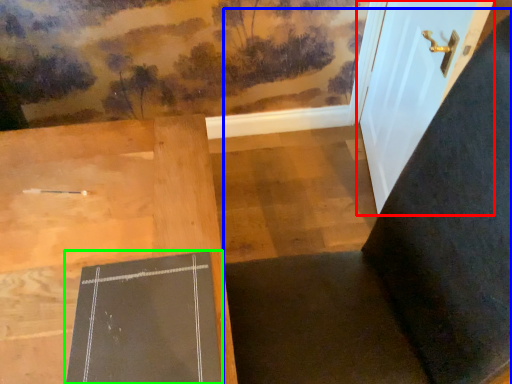
Question: Considering the real-world distances, which object is farthest from door (highlighted by a red box)? chair (highlighted by a blue box) or bulletin board (highlighted by a green box)?

Choices:
 (A) chair
 (B) bulletin board

Answer: (B)